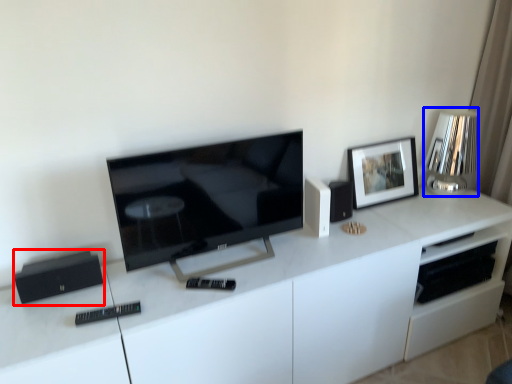
Question: Which object appears farthest to the camera in this image, appliance (highlighted by a red box) or lamp (highlighted by a blue box)?

Choices:
 (A) appliance
 (B) lamp

Answer: (B)